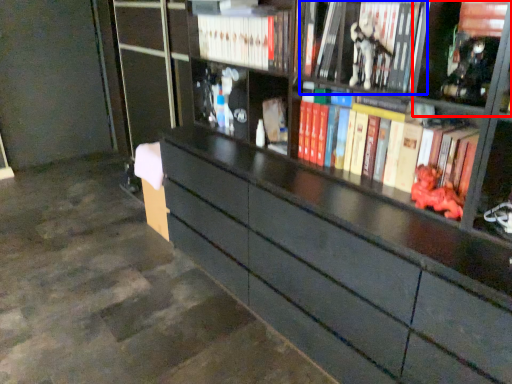
Question: Which of the following is the farthest to the observer, cabinet (highlighted by a red box) or book (highlighted by a blue box)?

Choices:
 (A) cabinet
 (B) book

Answer: (B)